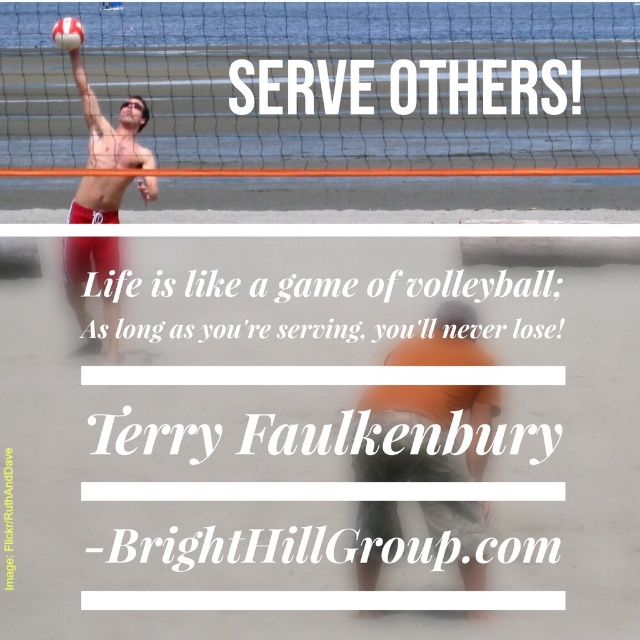
Question: Which point is closer to the camera?

Choices:
 (A) matte red shorts at left
 (B) matte skin at center
 (C) white matte volleyball at center

Answer: (B)

Question: Does matte skin at center appear under white matte volleyball at center?

Choices:
 (A) no
 (B) yes

Answer: (B)

Question: Does matte red shorts at left come in front of white matte volleyball at center?

Choices:
 (A) yes
 (B) no

Answer: (A)

Question: Which of the following is the closest to the observer?

Choices:
 (A) white matte volleyball at center
 (B) matte red shorts at left
 (C) matte skin at center

Answer: (C)

Question: Among these objects, which one is nearest to the camera?

Choices:
 (A) matte red shorts at left
 (B) white matte volleyball at center

Answer: (A)

Question: Does matte red shorts at left have a lesser width compared to white matte volleyball at center?

Choices:
 (A) yes
 (B) no

Answer: (B)